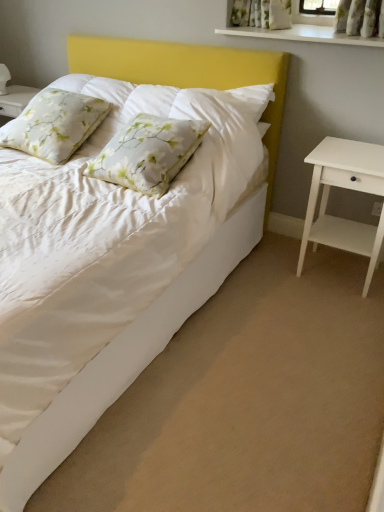
This screenshot has width=384, height=512. Identify the location of free location in front of white matte nightstand at right. (339, 316).